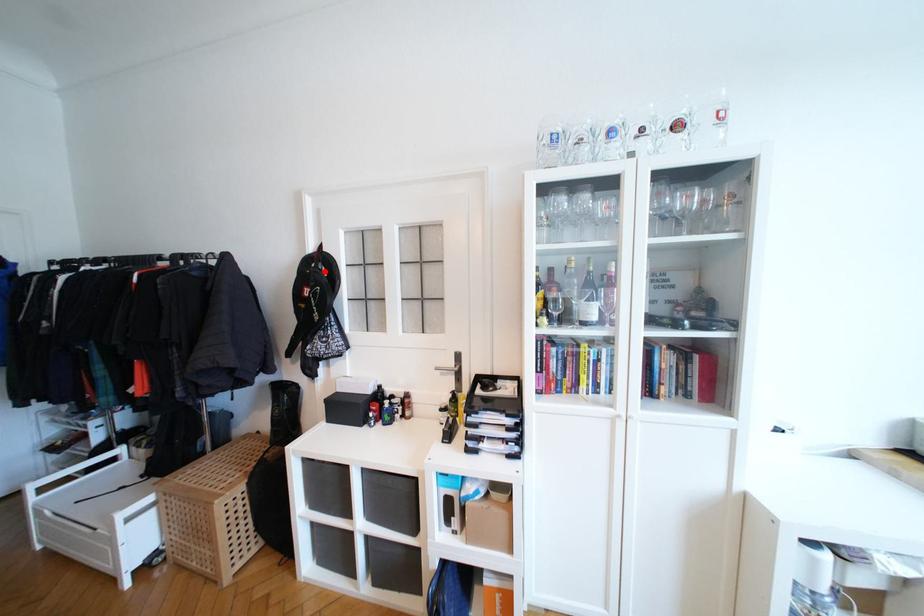
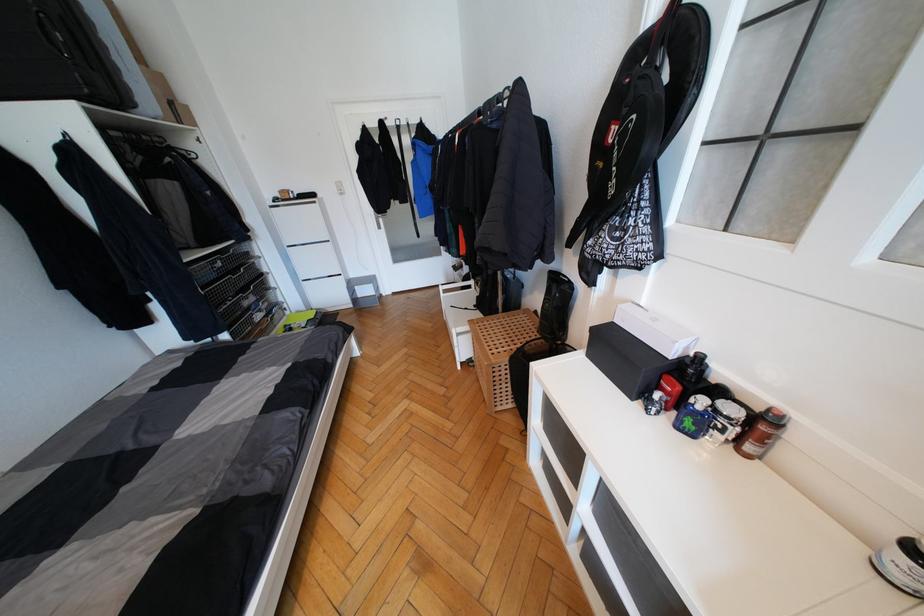
Locate, in the second image, the point that corresponds to the highlighted location in the first image.

(662, 71)